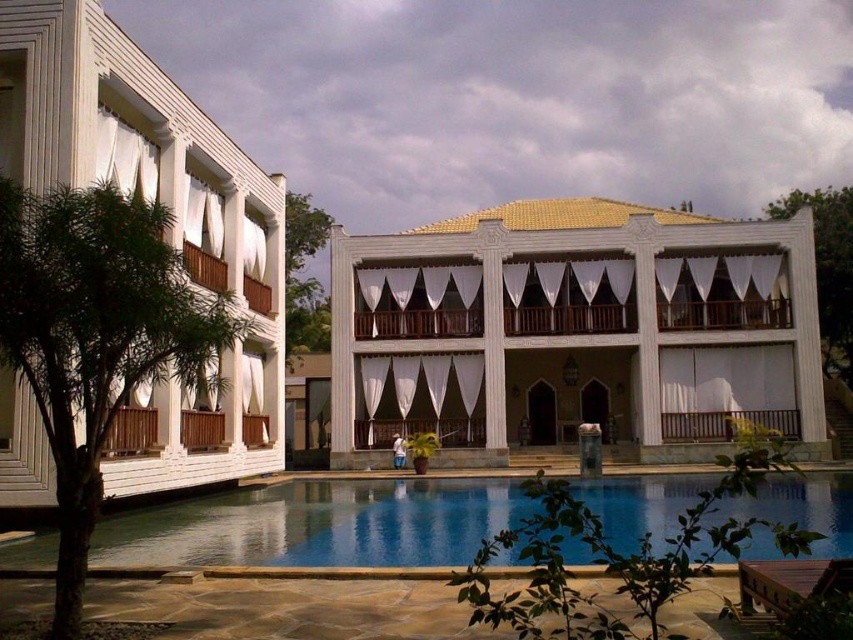
Question: Which object appears farthest from the camera in this image?

Choices:
 (A) green leafy tree at upper right
 (B) green leafy tree at center
 (C) white matte building at left

Answer: (A)

Question: Which is farther from the blue glassy swimming pool at center?

Choices:
 (A) white matte building at left
 (B) white textured building at center
 (C) green leafy tree at center
 (D) green leafy tree at upper right

Answer: (D)

Question: Is white textured building at center further to the viewer compared to green leafy tree at left?

Choices:
 (A) yes
 (B) no

Answer: (A)

Question: From the image, what is the correct spatial relationship of green leafy tree at upper right in relation to green leafy tree at center?

Choices:
 (A) right
 (B) left

Answer: (A)

Question: Is green leafy tree at left smaller than green leafy tree at center?

Choices:
 (A) yes
 (B) no

Answer: (A)

Question: Which point is farther from the camera taking this photo?

Choices:
 (A) tap(79, 550)
 (B) tap(351, 413)

Answer: (B)